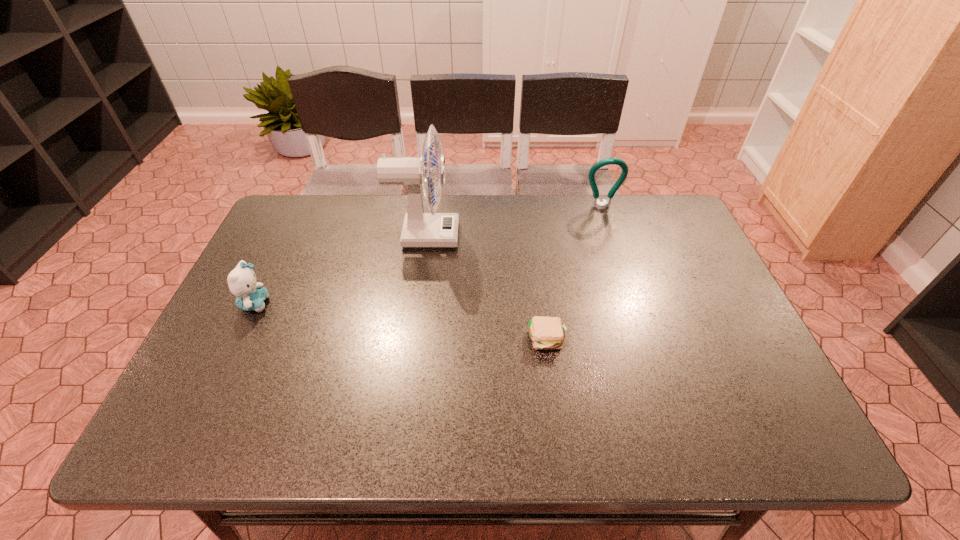
You are a GUI agent. You are given a task and a screenshot of the screen. Output one action in this format:
    pyautogui.click(x=<x>, y=<y>)
    Task: Click on the vacant space at the far right corner of the desktop
    Image resolution: width=960 pixels, height=540 pixels.
    Given the screenshot: What is the action you would take?
    pyautogui.click(x=668, y=228)

The image size is (960, 540). Identify the location of vacant region between the second tallest object and the kitten. (428, 255).

Identify the location of vacant point located between the rightmost object and the kitten. The height and width of the screenshot is (540, 960). (428, 255).

Identify the location of vacant area between the third object from left to right and the fan. The height and width of the screenshot is (540, 960). (486, 287).

You are a GUI agent. You are given a task and a screenshot of the screen. Output one action in this format:
    pyautogui.click(x=<x>, y=<y>)
    Task: Click on the free space that is in between the third object from right to left and the second tallest object
    
    Given the screenshot: What is the action you would take?
    pyautogui.click(x=513, y=221)

You are a GUI agent. You are given a task and a screenshot of the screen. Output one action in this format:
    pyautogui.click(x=<x>, y=<y>)
    Task: Click on the free area in between the third object from right to left and the leftmost object
    This screenshot has width=960, height=540.
    Given the screenshot: What is the action you would take?
    pyautogui.click(x=340, y=269)

Where is `unoccupied position between the patty and the second shortest object`? This screenshot has height=540, width=960. unoccupied position between the patty and the second shortest object is located at coordinates (401, 321).

The height and width of the screenshot is (540, 960). In order to click on free space between the tallest object and the bottle opener in this screenshot , I will do `click(513, 221)`.

Where is `free spot between the nearest object and the leftmost object`? The width and height of the screenshot is (960, 540). free spot between the nearest object and the leftmost object is located at coordinates (401, 321).

Where is `vacant space that is in between the kitten and the third object from left to right`? vacant space that is in between the kitten and the third object from left to right is located at coordinates (401, 321).